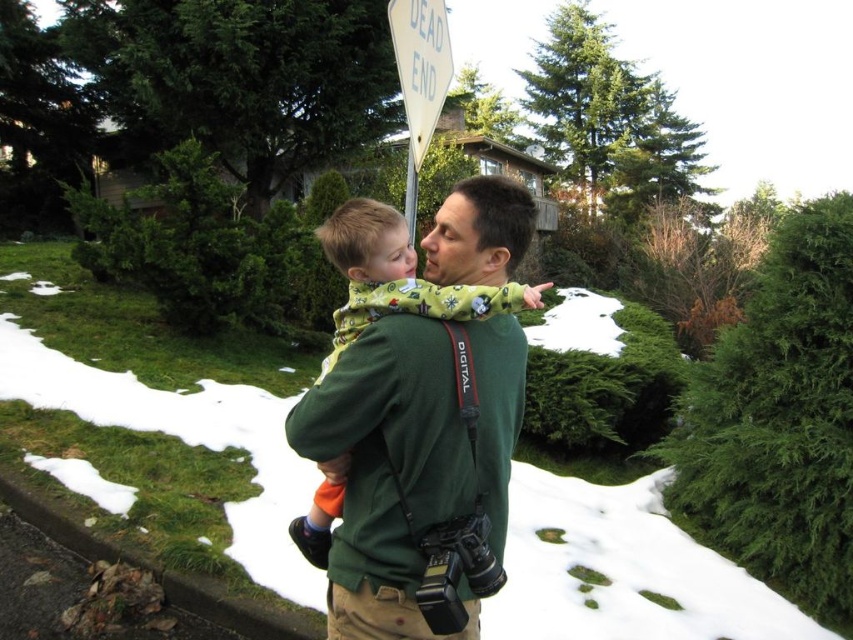
You are the photographer in the scene. You notice two points marked in the image. The first point is at coordinates point (364, 253) and the second is at point (415, 32). Which point is closer to you, the photographer?

Point (364, 253) is in front of point (415, 32), so it is closer to you.